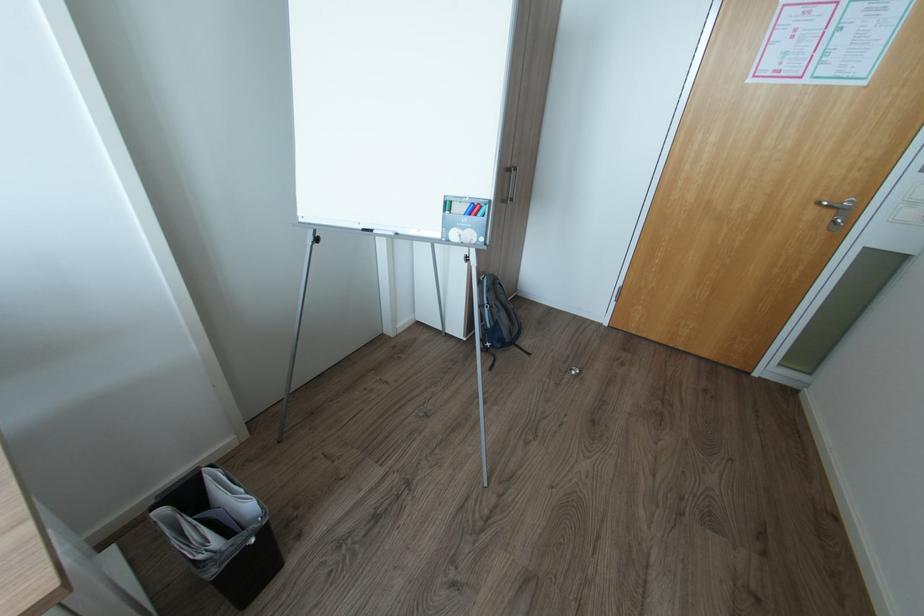
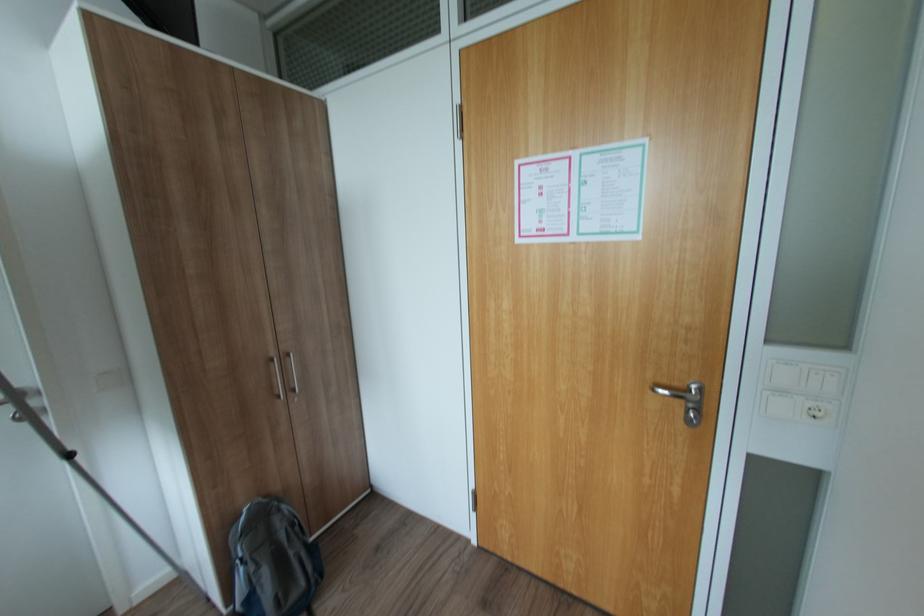
The images are taken continuously from a first-person perspective. In which direction are you moving?

The cameraman walked toward right, forward.